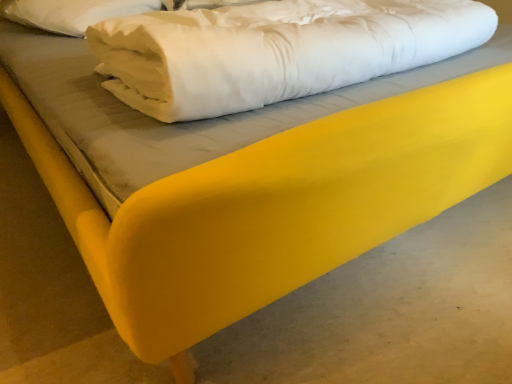
Question: Considering the relative positions of white soft pillow at upper left and white soft fabric at center in the image provided, is white soft pillow at upper left to the right of white soft fabric at center from the viewer's perspective?

Choices:
 (A) yes
 (B) no

Answer: (B)

Question: Does white soft pillow at upper left have a greater width compared to white soft fabric at center?

Choices:
 (A) yes
 (B) no

Answer: (B)

Question: Does white soft pillow at upper left have a lesser width compared to white soft fabric at center?

Choices:
 (A) no
 (B) yes

Answer: (B)

Question: Could white soft fabric at center be considered to be inside white soft pillow at upper left?

Choices:
 (A) no
 (B) yes

Answer: (A)

Question: From the image's perspective, is white soft pillow at upper left on top of white soft fabric at center?

Choices:
 (A) no
 (B) yes

Answer: (B)

Question: Does white soft pillow at upper left have a greater height compared to white soft fabric at center?

Choices:
 (A) yes
 (B) no

Answer: (B)

Question: Is white soft fabric at center beside white soft pillow at upper left?

Choices:
 (A) no
 (B) yes

Answer: (A)

Question: Does white soft fabric at center have a greater width compared to white soft pillow at upper left?

Choices:
 (A) no
 (B) yes

Answer: (B)

Question: From the image's perspective, is white soft fabric at center beneath white soft pillow at upper left?

Choices:
 (A) no
 (B) yes

Answer: (B)

Question: Can you confirm if white soft fabric at center is taller than white soft pillow at upper left?

Choices:
 (A) yes
 (B) no

Answer: (A)

Question: From a real-world perspective, is white soft fabric at center positioned under white soft pillow at upper left based on gravity?

Choices:
 (A) yes
 (B) no

Answer: (B)

Question: Is white soft fabric at center turned away from white soft pillow at upper left?

Choices:
 (A) no
 (B) yes

Answer: (B)

Question: Visually, is white soft pillow at upper left positioned to the left or to the right of white soft fabric at center?

Choices:
 (A) left
 (B) right

Answer: (A)